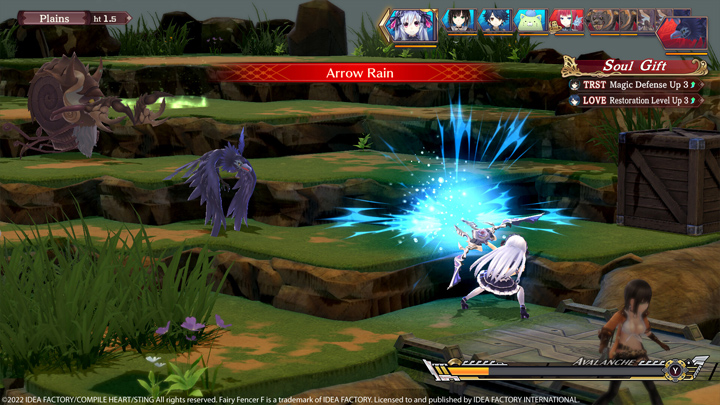
This screenshot has height=405, width=720. I want to click on crate, so click(x=648, y=199).